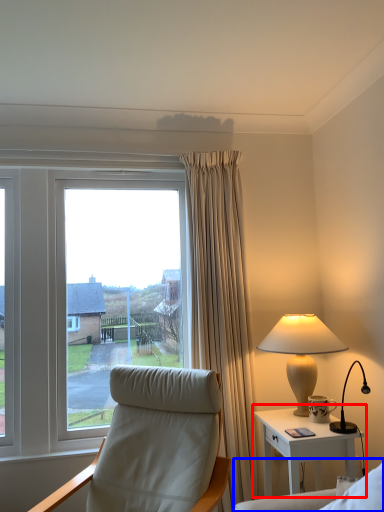
Question: Which point is further to the camera, nightstand (highlighted by a red box) or couch (highlighted by a blue box)?

Choices:
 (A) nightstand
 (B) couch

Answer: (A)